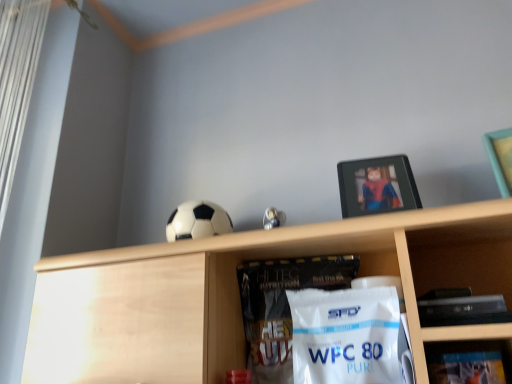
What is the approximate width of metallic silver picture frame at upper center?

10.75 centimeters.

This screenshot has height=384, width=512. What do you see at coordinates (377, 186) in the screenshot? I see `metallic silver picture frame at upper center` at bounding box center [377, 186].

Measure the distance between black matte soccer ball at upper center and camera.

black matte soccer ball at upper center and camera are 33.66 inches apart.

The width and height of the screenshot is (512, 384). What are the coordinates of `wooden shelf at upper center, which is counted as the 2th shelf, starting from the back` in the screenshot? It's located at (239, 295).

Identify the location of metallic silver picture frame at upper center. The image size is (512, 384). (377, 186).

Considering the points (492, 382) and (385, 170), which point is in front, point (492, 382) or point (385, 170)?

Positioned in front is point (492, 382).

What's the angular difference between metallic silver frame at upper right, which is the 1th shelf from back to front, and metallic silver picture frame at upper center's facing directions?

0.287 degrees separate the facing orientations of metallic silver frame at upper right, which is the 1th shelf from back to front, and metallic silver picture frame at upper center.

Between metallic silver frame at upper right, which is the 1th shelf from back to front, and metallic silver picture frame at upper center, which one appears on the right side from the viewer's perspective?

From the viewer's perspective, metallic silver frame at upper right, which is the 1th shelf from back to front, appears more on the right side.

From the image's perspective, which is above, wooden shelf at upper center, the 2th shelf positioned from the right, or metallic silver frame at upper right, which is the 1th shelf from back to front?

wooden shelf at upper center, the 2th shelf positioned from the right, from the image's perspective.

From a real-world perspective, which is physically above, wooden shelf at upper center, which is the first shelf in front-to-back order, or metallic silver frame at upper right, which ranks as the 1th shelf in right-to-left order?

In real-world perspective, wooden shelf at upper center, which is the first shelf in front-to-back order, is above.

Is point (130, 317) positioned in front of point (482, 357)?

No.

From a real-world perspective, is black matte soccer ball at upper center located higher than metallic silver picture frame at upper center?

No, from a real-world perspective, black matte soccer ball at upper center is not above metallic silver picture frame at upper center.

Which object is positioned more to the left, black matte soccer ball at upper center or metallic silver picture frame at upper center?

Positioned to the left is black matte soccer ball at upper center.

Looking at the image, does black matte soccer ball at upper center seem bigger or smaller compared to metallic silver picture frame at upper center?

Considering their sizes, black matte soccer ball at upper center takes up less space than metallic silver picture frame at upper center.

From the image's perspective, which object appears higher, black matte soccer ball at upper center or metallic silver picture frame at upper center?

metallic silver picture frame at upper center, from the image's perspective.

Is metallic silver picture frame at upper center positioned far away from wooden shelf at upper center, which is the first shelf in front-to-back order?

No, metallic silver picture frame at upper center is not far away from wooden shelf at upper center, which is the first shelf in front-to-back order.

From a real-world perspective, is metallic silver picture frame at upper center positioned above or below wooden shelf at upper center, which is counted as the 2th shelf, starting from the back?

metallic silver picture frame at upper center is situated higher than wooden shelf at upper center, which is counted as the 2th shelf, starting from the back, in the real world.

Is the depth of metallic silver picture frame at upper center greater than that of wooden shelf at upper center, the 2th shelf positioned from the right?

Yes, it is behind wooden shelf at upper center, the 2th shelf positioned from the right.

Identify the location of shelf that is the 1st object to the right of the black matte soccer ball at upper center, starting at the anchor. The height and width of the screenshot is (384, 512). (239, 295).

Between wooden shelf at upper center, the 2th shelf positioned from the right, and black matte soccer ball at upper center, which one has less height?

With less height is black matte soccer ball at upper center.

Between wooden shelf at upper center, which is the first shelf in front-to-back order, and black matte soccer ball at upper center, which one has smaller size?

With smaller size is black matte soccer ball at upper center.

How far apart are wooden shelf at upper center, which is counted as the 2th shelf, starting from the back, and black matte soccer ball at upper center?

wooden shelf at upper center, which is counted as the 2th shelf, starting from the back, is 9.42 inches away from black matte soccer ball at upper center.

From the image's perspective, is metallic silver frame at upper right, acting as the second shelf starting from the left, below wooden shelf at upper center, the 1th shelf in the left-to-right sequence?

Yes, from the image's perspective, metallic silver frame at upper right, acting as the second shelf starting from the left, is beneath wooden shelf at upper center, the 1th shelf in the left-to-right sequence.

The height and width of the screenshot is (384, 512). In order to click on shelf located above the metallic silver frame at upper right, which ranks as the 1th shelf in right-to-left order (from a real-world perspective) in this screenshot , I will do `click(239, 295)`.

In terms of height, does metallic silver frame at upper right, acting as the second shelf starting from the left, look taller or shorter compared to wooden shelf at upper center, the 1th shelf in the left-to-right sequence?

In the image, metallic silver frame at upper right, acting as the second shelf starting from the left, appears to be shorter than wooden shelf at upper center, the 1th shelf in the left-to-right sequence.

From the image's perspective, would you say metallic silver picture frame at upper center is shown under black matte soccer ball at upper center?

Incorrect, from the image's perspective, metallic silver picture frame at upper center is higher than black matte soccer ball at upper center.

Would you say metallic silver picture frame at upper center contains black matte soccer ball at upper center?

Definitely not — black matte soccer ball at upper center is not inside metallic silver picture frame at upper center.

Considering the sizes of objects metallic silver picture frame at upper center and black matte soccer ball at upper center in the image provided, who is bigger, metallic silver picture frame at upper center or black matte soccer ball at upper center?

metallic silver picture frame at upper center is bigger.

This screenshot has width=512, height=384. I want to click on picture frame on the left side of metallic silver frame at upper right, acting as the second shelf starting from the left, so click(x=377, y=186).

Where is `shelf below the wooden shelf at upper center, the 2th shelf positioned from the right (from a real-world perspective)`? The width and height of the screenshot is (512, 384). shelf below the wooden shelf at upper center, the 2th shelf positioned from the right (from a real-world perspective) is located at coordinates (469, 361).

Which object lies further to the anchor point wooden shelf at upper center, the 2th shelf positioned from the right, black matte soccer ball at upper center or metallic silver picture frame at upper center?

metallic silver picture frame at upper center.

From the image, which object appears to be farther from metallic silver frame at upper right, acting as the second shelf starting from the left, black matte soccer ball at upper center or metallic silver picture frame at upper center?

black matte soccer ball at upper center.

Which object lies further to the anchor point metallic silver frame at upper right, which ranks as the 1th shelf in right-to-left order, metallic silver picture frame at upper center or wooden shelf at upper center, which is counted as the 2th shelf, starting from the back?

The object further to metallic silver frame at upper right, which ranks as the 1th shelf in right-to-left order, is wooden shelf at upper center, which is counted as the 2th shelf, starting from the back.

When comparing their distances from black matte soccer ball at upper center, does wooden shelf at upper center, the 2th shelf positioned from the right, or metallic silver frame at upper right, positioned as the second shelf in front-to-back order, seem closer?

wooden shelf at upper center, the 2th shelf positioned from the right, is positioned closer to the anchor black matte soccer ball at upper center.

Estimate the real-world distances between objects in this image. Which object is closer to metallic silver picture frame at upper center, metallic silver frame at upper right, acting as the second shelf starting from the left, or black matte soccer ball at upper center?

metallic silver frame at upper right, acting as the second shelf starting from the left, lies closer to metallic silver picture frame at upper center than the other object.

Estimate the real-world distances between objects in this image. Which object is further from metallic silver frame at upper right, positioned as the second shelf in front-to-back order, metallic silver picture frame at upper center or black matte soccer ball at upper center?

black matte soccer ball at upper center is further to metallic silver frame at upper right, positioned as the second shelf in front-to-back order.

When comparing their distances from black matte soccer ball at upper center, does metallic silver picture frame at upper center or metallic silver frame at upper right, which is the 1th shelf from back to front, seem closer?

metallic silver picture frame at upper center is closer to black matte soccer ball at upper center.

Which object lies further to the anchor point metallic silver picture frame at upper center, black matte soccer ball at upper center or metallic silver frame at upper right, acting as the second shelf starting from the left?

Answer: black matte soccer ball at upper center is positioned further to the anchor metallic silver picture frame at upper center.

The height and width of the screenshot is (384, 512). I want to click on shelf situated between black matte soccer ball at upper center and metallic silver frame at upper right, acting as the second shelf starting from the left, from left to right, so click(x=239, y=295).

Locate an element on the screen. This screenshot has height=384, width=512. picture frame between black matte soccer ball at upper center and metallic silver frame at upper right, acting as the second shelf starting from the left, from left to right is located at coordinates (x=377, y=186).

Locate an element on the screen. The height and width of the screenshot is (384, 512). shelf between metallic silver picture frame at upper center and metallic silver frame at upper right, which is the 1th shelf from back to front, in the vertical direction is located at coordinates (239, 295).

Locate an element on the screen. shelf between black matte soccer ball at upper center and metallic silver picture frame at upper center in the horizontal direction is located at coordinates (x=239, y=295).